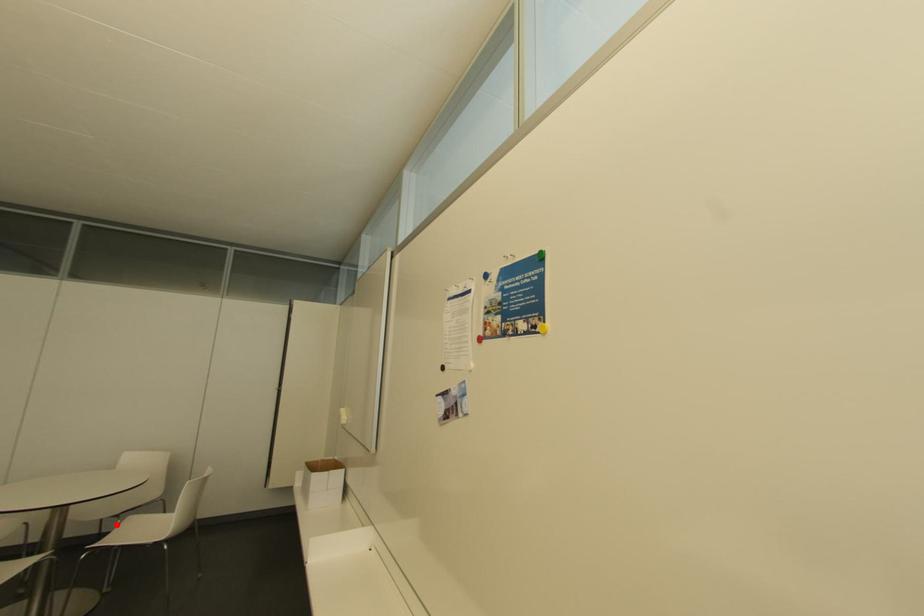
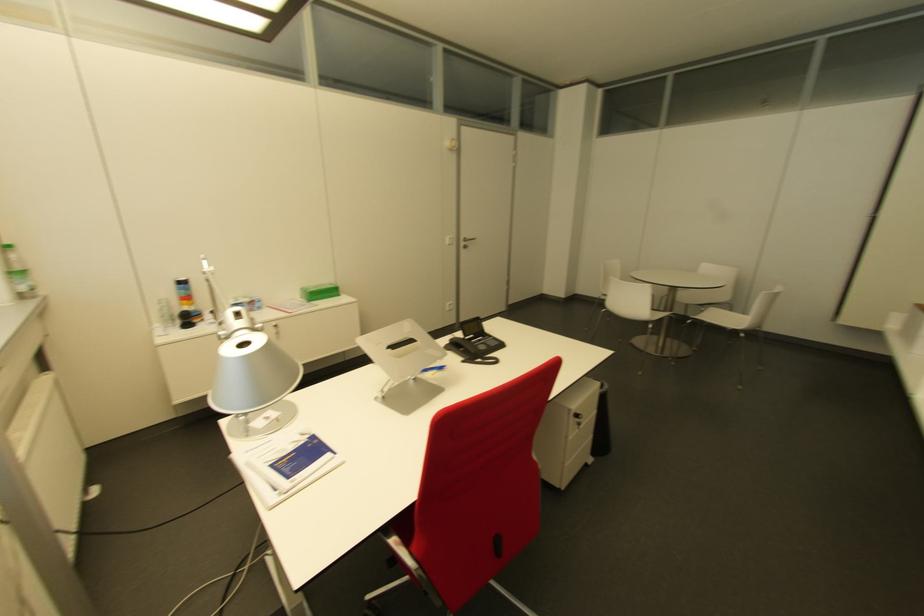
The point at the highlighted location is marked in the first image. Where is the corresponding point in the second image?

(700, 310)